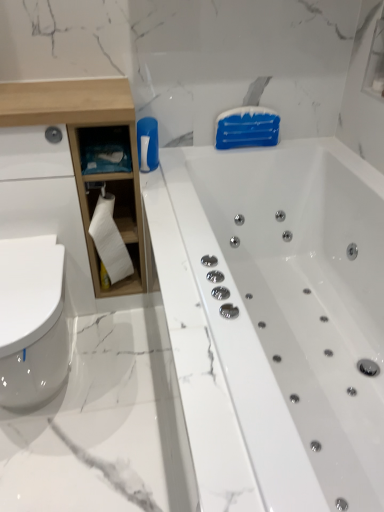
Question: Is white matte toilet paper at left at the right side of white glossy bathtub at center?

Choices:
 (A) yes
 (B) no

Answer: (B)

Question: Is white matte toilet paper at left positioned before white glossy bathtub at center?

Choices:
 (A) no
 (B) yes

Answer: (A)

Question: From the image's perspective, is white matte toilet paper at left below white glossy bathtub at center?

Choices:
 (A) no
 (B) yes

Answer: (A)

Question: Considering the relative sizes of white matte toilet paper at left and white glossy bathtub at center in the image provided, is white matte toilet paper at left wider than white glossy bathtub at center?

Choices:
 (A) no
 (B) yes

Answer: (A)

Question: Is white matte toilet paper at left outside white glossy bathtub at center?

Choices:
 (A) yes
 (B) no

Answer: (A)

Question: Considering the positions of white glossy bathtub at center and white matte toilet paper at left in the image, is white glossy bathtub at center taller or shorter than white matte toilet paper at left?

Choices:
 (A) tall
 (B) short

Answer: (A)

Question: Considering their positions, is white glossy bathtub at center located in front of or behind white matte toilet paper at left?

Choices:
 (A) front
 (B) behind

Answer: (A)

Question: Do you think white glossy bathtub at center is within white matte toilet paper at left, or outside of it?

Choices:
 (A) outside
 (B) inside

Answer: (A)

Question: Is white glossy bathtub at center wider or thinner than white matte toilet paper at left?

Choices:
 (A) wide
 (B) thin

Answer: (A)

Question: From a real-world perspective, is white wood cabinet at left physically located above or below white matte toilet paper at left?

Choices:
 (A) below
 (B) above

Answer: (B)

Question: Is white wood cabinet at left bigger or smaller than white matte toilet paper at left?

Choices:
 (A) big
 (B) small

Answer: (A)

Question: Does point (31, 88) appear closer or farther from the camera than point (97, 226)?

Choices:
 (A) farther
 (B) closer

Answer: (B)

Question: From the image's perspective, is white wood cabinet at left located above or below white matte toilet paper at left?

Choices:
 (A) below
 (B) above

Answer: (B)

Question: Is white wood cabinet at left inside the boundaries of white glossy bathtub at center, or outside?

Choices:
 (A) inside
 (B) outside

Answer: (B)

Question: From their relative heights in the image, would you say white wood cabinet at left is taller or shorter than white glossy bathtub at center?

Choices:
 (A) tall
 (B) short

Answer: (A)